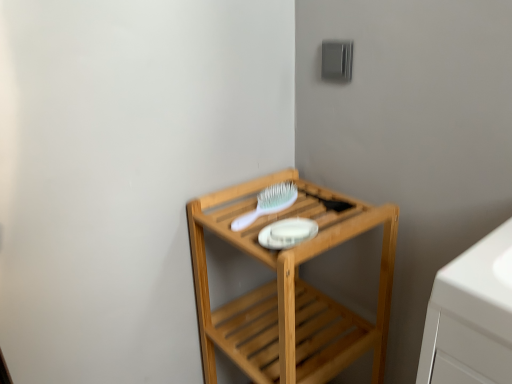
Identify the location of vacant area located to the right-hand side of white plastic brush at upper center. The width and height of the screenshot is (512, 384). (318, 206).